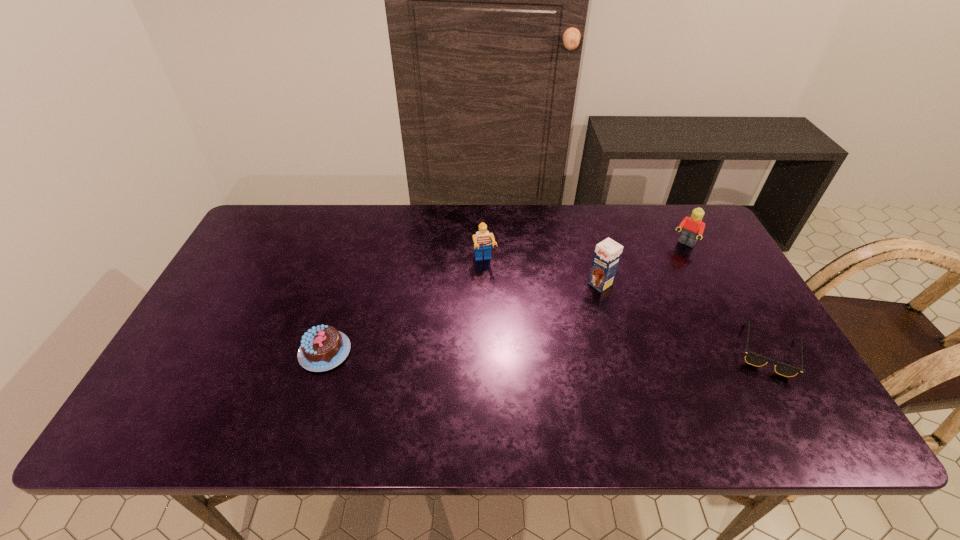
The image size is (960, 540). In order to click on vacant spot on the desktop that is between the chocolate cake and the sunglasses and is positioned on the face of the fourth object from right to left in this screenshot , I will do `click(508, 351)`.

Where is `vacant spot on the desktop that is between the fourth tallest object and the sunglasses and is positioned on the front label of the chocolate milk`? vacant spot on the desktop that is between the fourth tallest object and the sunglasses and is positioned on the front label of the chocolate milk is located at coordinates (501, 351).

Locate an element on the screen. This screenshot has height=540, width=960. vacant space on the desktop that is between the leftmost object and the sunglasses and is positioned on the face of the farther Lego is located at coordinates (604, 351).